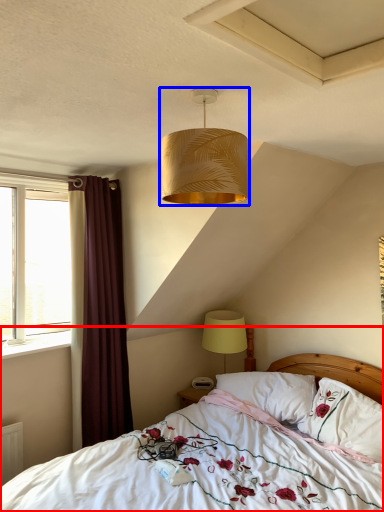
Question: Among these objects, which one is nearest to the camera, bed (highlighted by a red box) or lamp (highlighted by a blue box)?

Choices:
 (A) bed
 (B) lamp

Answer: (A)